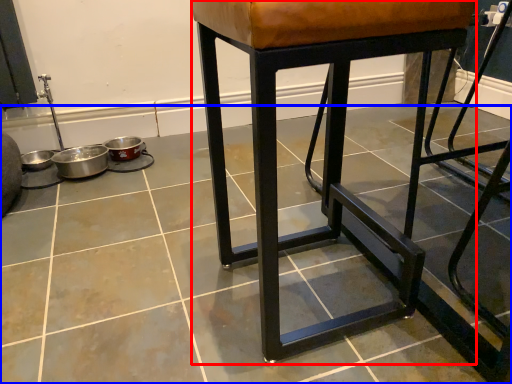
Question: Which object is closer to the camera taking this photo, stool (highlighted by a red box) or concrete (highlighted by a blue box)?

Choices:
 (A) stool
 (B) concrete

Answer: (B)